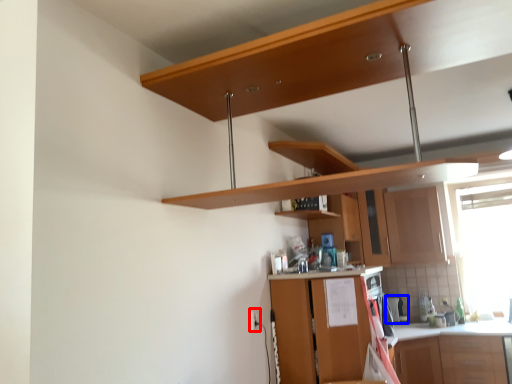
Question: Which point is further to the camera, electric outlet (highlighted by a red box) or appliance (highlighted by a blue box)?

Choices:
 (A) electric outlet
 (B) appliance

Answer: (B)